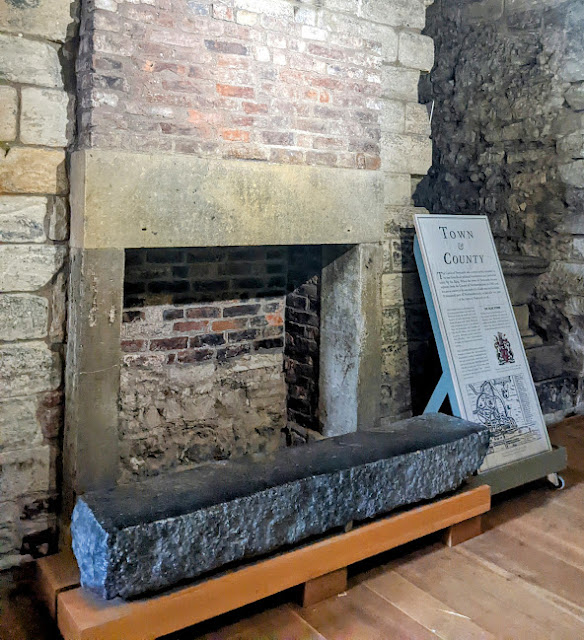
Where is `wooden floor`? The image size is (584, 640). wooden floor is located at coordinates (381, 618), (517, 554).